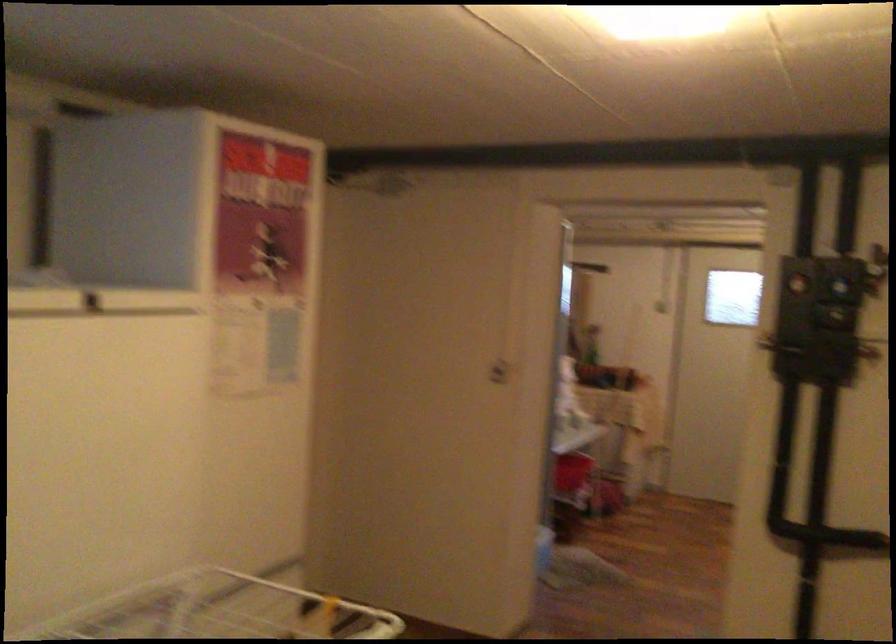
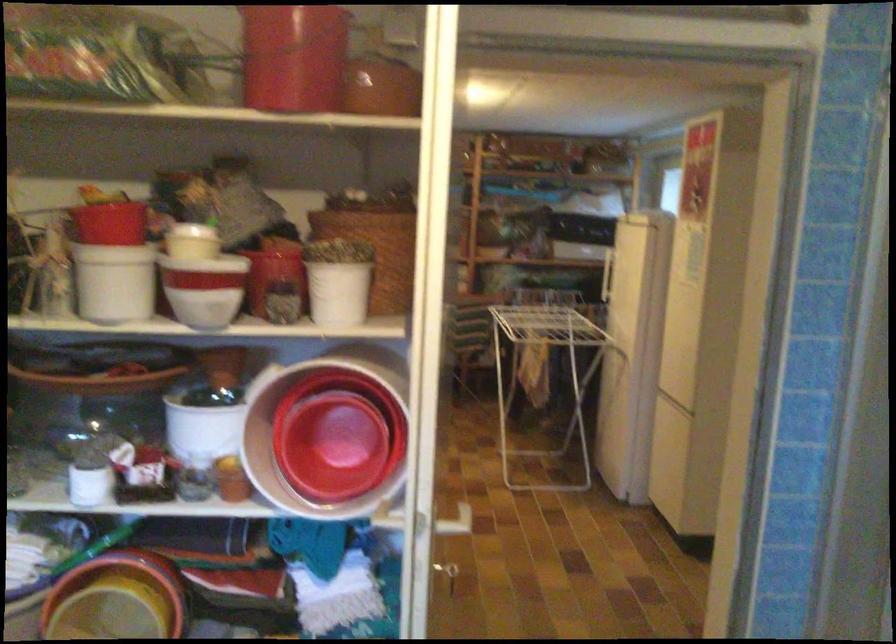
Question: I am providing you with two images of the same scene from different viewpoints. Which of the following objects are not visible in image2?

Choices:
 (A) yellow plastic bucket
 (B) refrigerator door handle
 (C) beige lampshade
 (D) brown clay pot

Answer: (B)